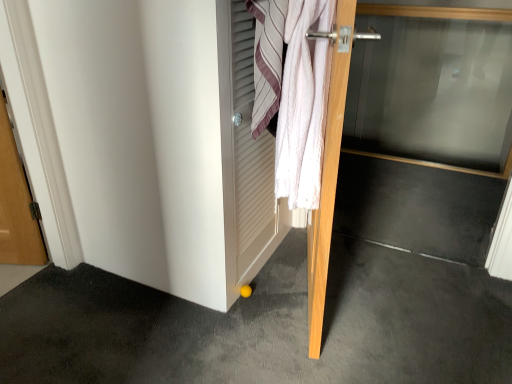
Question: Does yellow rubber ball at lower center have a greater width compared to white textured towel at center?

Choices:
 (A) no
 (B) yes

Answer: (B)

Question: From a real-world perspective, is yellow rubber ball at lower center located beneath white textured towel at center?

Choices:
 (A) no
 (B) yes

Answer: (B)

Question: Is yellow rubber ball at lower center to the right of white textured towel at center from the viewer's perspective?

Choices:
 (A) no
 (B) yes

Answer: (A)

Question: Is yellow rubber ball at lower center smaller than white textured towel at center?

Choices:
 (A) no
 (B) yes

Answer: (A)

Question: Is yellow rubber ball at lower center turned away from white textured towel at center?

Choices:
 (A) yes
 (B) no

Answer: (B)

Question: Is yellow rubber ball at lower center in front of white textured towel at center?

Choices:
 (A) no
 (B) yes

Answer: (B)

Question: Does white cotton towel at upper right come in front of yellow rubber ball at lower center?

Choices:
 (A) yes
 (B) no

Answer: (B)

Question: Does white cotton towel at upper right appear on the right side of yellow rubber ball at lower center?

Choices:
 (A) no
 (B) yes

Answer: (B)

Question: Is white cotton towel at upper right to the left of yellow rubber ball at lower center from the viewer's perspective?

Choices:
 (A) yes
 (B) no

Answer: (B)

Question: Can you see white cotton towel at upper right touching yellow rubber ball at lower center?

Choices:
 (A) no
 (B) yes

Answer: (A)

Question: From the image's perspective, does white cotton towel at upper right appear higher than yellow rubber ball at lower center?

Choices:
 (A) yes
 (B) no

Answer: (A)

Question: Considering the relative sizes of white cotton towel at upper right and yellow rubber ball at lower center in the image provided, is white cotton towel at upper right bigger than yellow rubber ball at lower center?

Choices:
 (A) no
 (B) yes

Answer: (A)

Question: Is white textured towel at center facing away from transparent glass door at center, placed as the first door when sorted from right to left?

Choices:
 (A) no
 (B) yes

Answer: (A)